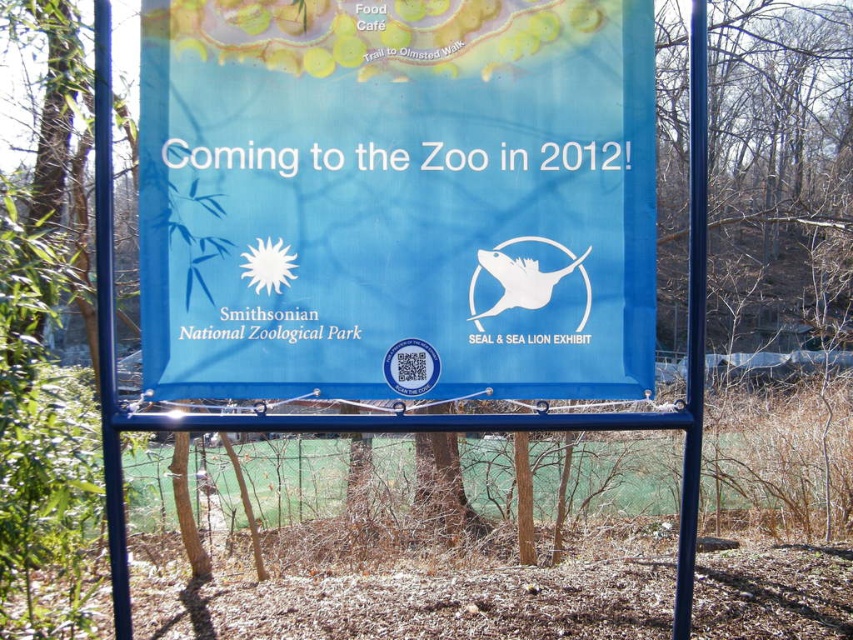
Question: Considering the relative positions of blue fabric sign at center and blue metallic pole at left in the image provided, where is blue fabric sign at center located with respect to blue metallic pole at left?

Choices:
 (A) above
 (B) below

Answer: (A)

Question: Is blue fabric sign at center to the right of blue metallic pole at right from the viewer's perspective?

Choices:
 (A) yes
 (B) no

Answer: (B)

Question: Which of these objects is positioned farthest from the blue metallic pole at left?

Choices:
 (A) blue fabric sign at center
 (B) blue metallic pole at right

Answer: (B)

Question: Which object is the closest to the blue metallic pole at right?

Choices:
 (A) blue metallic pole at left
 (B) blue fabric sign at center

Answer: (B)

Question: Where is blue fabric sign at center located in relation to blue metallic pole at left in the image?

Choices:
 (A) left
 (B) right

Answer: (B)

Question: Based on their relative distances, which object is farther from the blue metallic pole at right?

Choices:
 (A) blue metallic pole at left
 (B) blue fabric sign at center

Answer: (A)